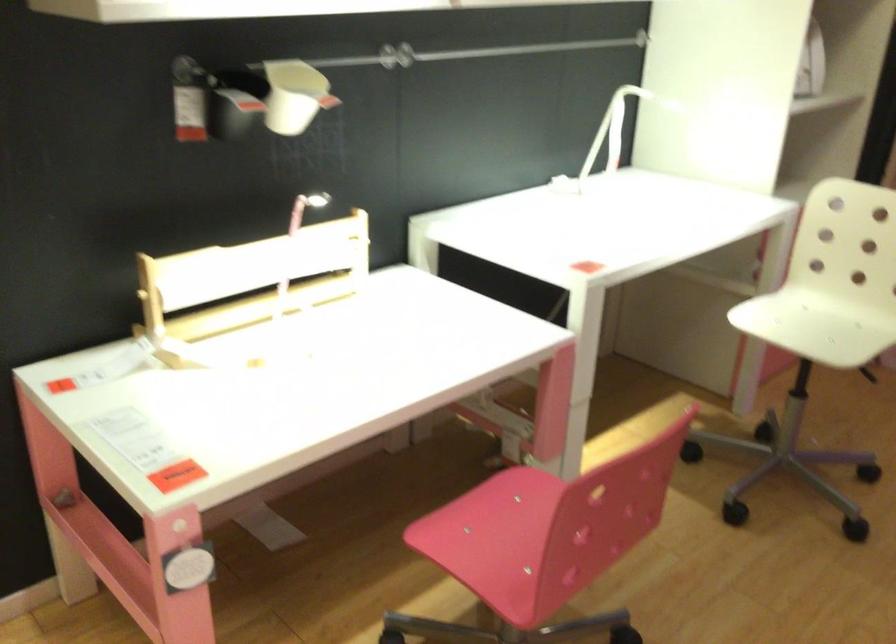
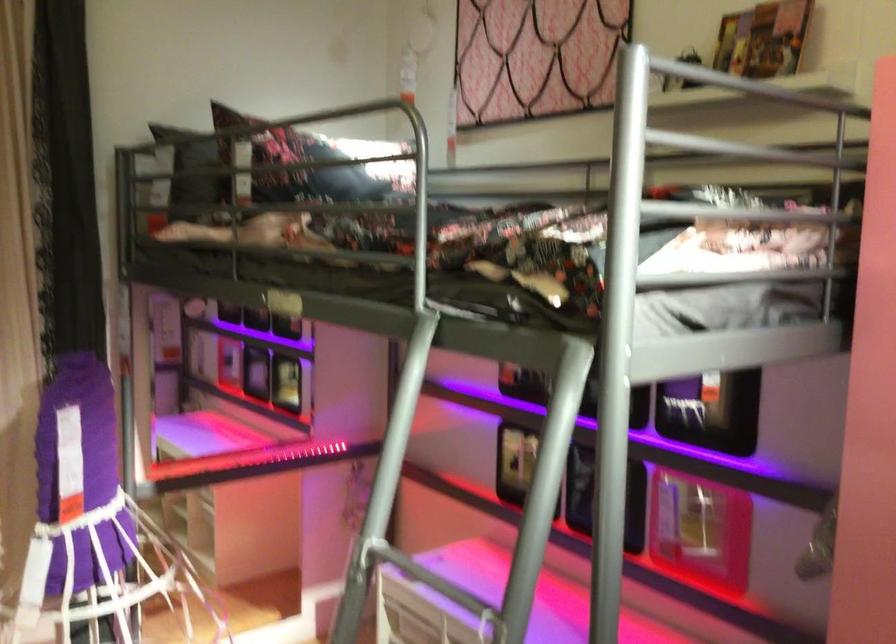
Question: The images are taken continuously from a first-person perspective. In which direction is your viewpoint rotating?

Choices:
 (A) Left
 (B) Right
 (C) Up
 (D) Down

Answer: (B)